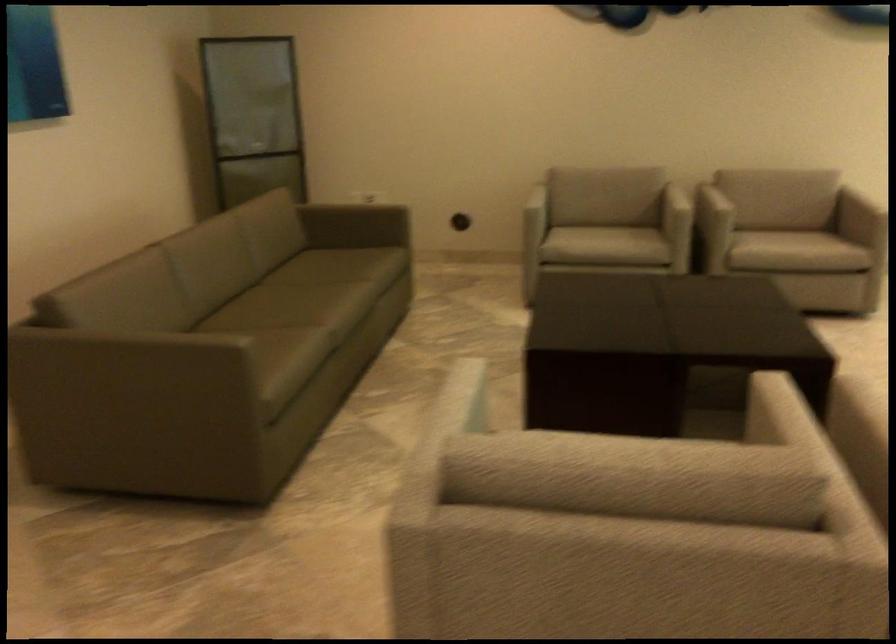
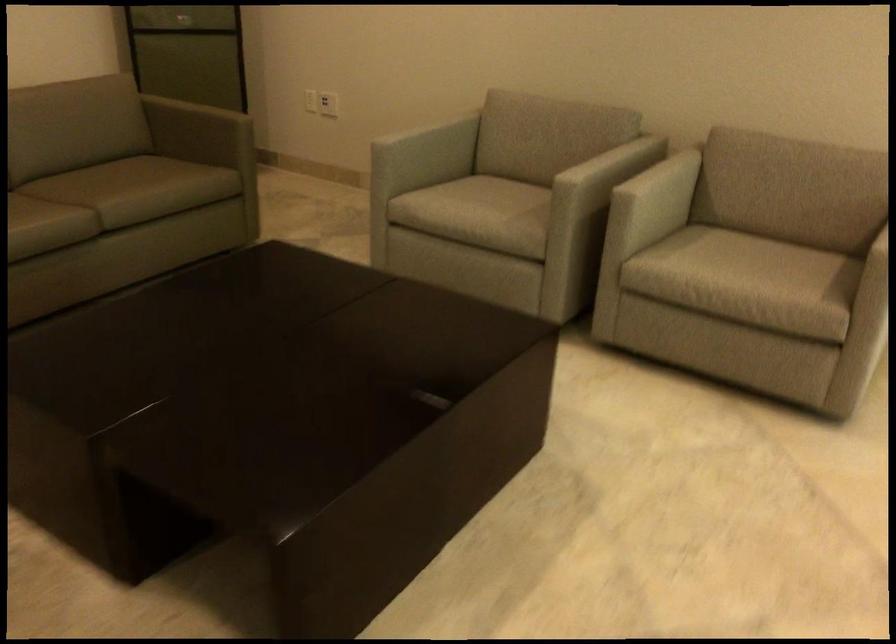
Where in the second image is the point corresponding to [388,194] from the first image?

(328, 104)